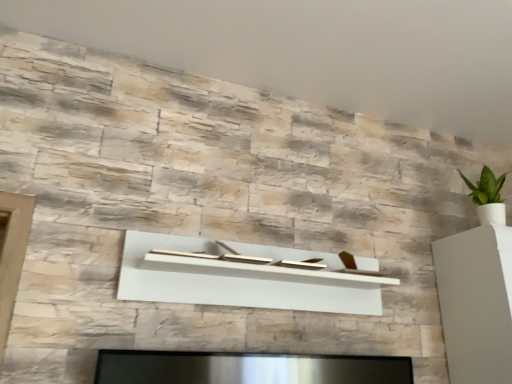
Question: Is white glossy vase at right outside of natural stone wall at upper center?

Choices:
 (A) no
 (B) yes

Answer: (B)

Question: From a real-world perspective, is white glossy vase at right below natural stone wall at upper center?

Choices:
 (A) yes
 (B) no

Answer: (A)

Question: Is white glossy vase at right smaller than natural stone wall at upper center?

Choices:
 (A) no
 (B) yes

Answer: (A)

Question: Is the depth of white glossy vase at right greater than that of natural stone wall at upper center?

Choices:
 (A) yes
 (B) no

Answer: (A)

Question: Considering the relative positions of white glossy vase at right and natural stone wall at upper center in the image provided, is white glossy vase at right to the right of natural stone wall at upper center from the viewer's perspective?

Choices:
 (A) yes
 (B) no

Answer: (A)

Question: Is point (172, 248) closer or farther from the camera than point (440, 316)?

Choices:
 (A) farther
 (B) closer

Answer: (B)

Question: From a real-world perspective, relative to white glossy vase at right, is white matte shelf at center vertically above or below?

Choices:
 (A) below
 (B) above

Answer: (B)

Question: Looking at their shapes, would you say white matte shelf at center is wider or thinner than white glossy vase at right?

Choices:
 (A) thin
 (B) wide

Answer: (A)

Question: Relative to white glossy vase at right, is white matte shelf at center in front or behind?

Choices:
 (A) behind
 (B) front

Answer: (B)

Question: From the image's perspective, is white matte shelf at center located above or below natural stone wall at upper center?

Choices:
 (A) below
 (B) above

Answer: (A)

Question: From a real-world perspective, is white matte shelf at center physically located above or below natural stone wall at upper center?

Choices:
 (A) below
 (B) above

Answer: (A)

Question: Visually, is white matte shelf at center positioned to the left or to the right of natural stone wall at upper center?

Choices:
 (A) right
 (B) left

Answer: (B)

Question: From their relative heights in the image, would you say white matte shelf at center is taller or shorter than natural stone wall at upper center?

Choices:
 (A) tall
 (B) short

Answer: (A)

Question: Looking at the image, does natural stone wall at upper center seem bigger or smaller compared to white matte shelf at center?

Choices:
 (A) big
 (B) small

Answer: (A)

Question: Is point (178, 8) positioned closer to the camera than point (151, 248)?

Choices:
 (A) closer
 (B) farther

Answer: (B)